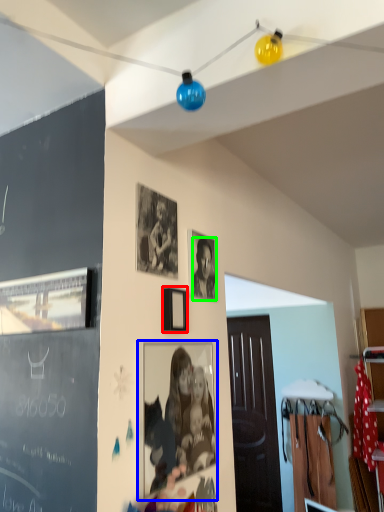
Question: Considering the real-world distances, which object is farthest from picture frame (highlighted by a red box)? picture frame (highlighted by a blue box) or person (highlighted by a green box)?

Choices:
 (A) picture frame
 (B) person

Answer: (A)